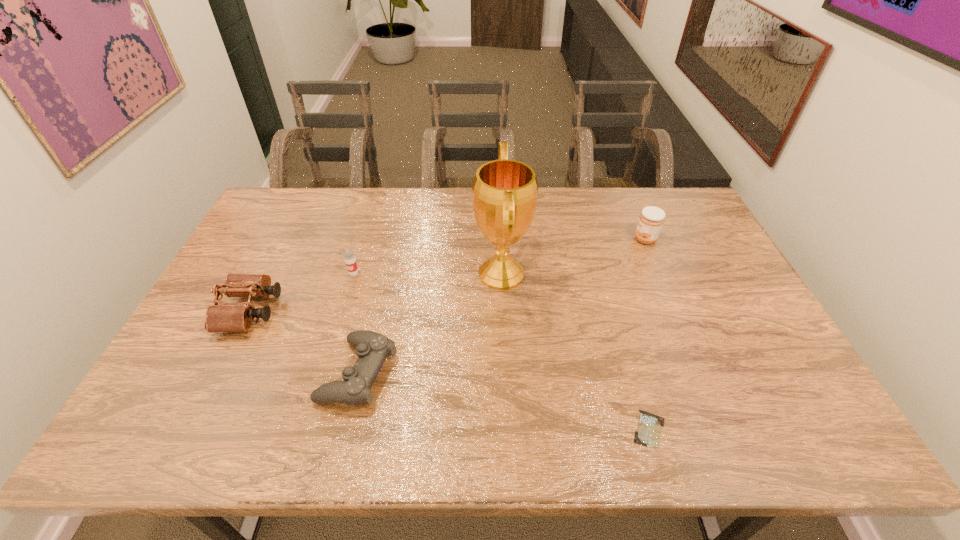
The image size is (960, 540). In order to click on the fourth object from left to right in this screenshot , I will do `click(504, 198)`.

At what (x,y) coordinates should I click in order to perform the action: click on award. Please return your answer as a coordinate pair (x, y). The width and height of the screenshot is (960, 540). Looking at the image, I should click on (504, 198).

You are a GUI agent. You are given a task and a screenshot of the screen. Output one action in this format:
    pyautogui.click(x=<x>, y=<y>)
    Task: Click on the jam
    The height and width of the screenshot is (540, 960).
    Given the screenshot: What is the action you would take?
    pyautogui.click(x=651, y=220)

At what (x,y) coordinates should I click in order to perform the action: click on cup. Please return your answer as a coordinate pair (x, y). The width and height of the screenshot is (960, 540). Looking at the image, I should click on (349, 257).

Where is `binoculars`? The width and height of the screenshot is (960, 540). binoculars is located at coordinates (229, 317).

You are a GUI agent. You are given a task and a screenshot of the screen. Output one action in this format:
    pyautogui.click(x=<x>, y=<y>)
    Task: Click on the second shortest object
    The image size is (960, 540).
    Given the screenshot: What is the action you would take?
    pyautogui.click(x=372, y=348)

Identify the location of the second object from right to left. The image size is (960, 540). (648, 433).

Locate an element on the screen. This screenshot has width=960, height=540. the shortest object is located at coordinates (648, 433).

Where is `vacant space located 0.050m on the front-facing side of the fourth object from left to right`? The height and width of the screenshot is (540, 960). vacant space located 0.050m on the front-facing side of the fourth object from left to right is located at coordinates (457, 274).

Image resolution: width=960 pixels, height=540 pixels. Identify the location of free spot located on the front-facing side of the fourth object from left to right. (374, 274).